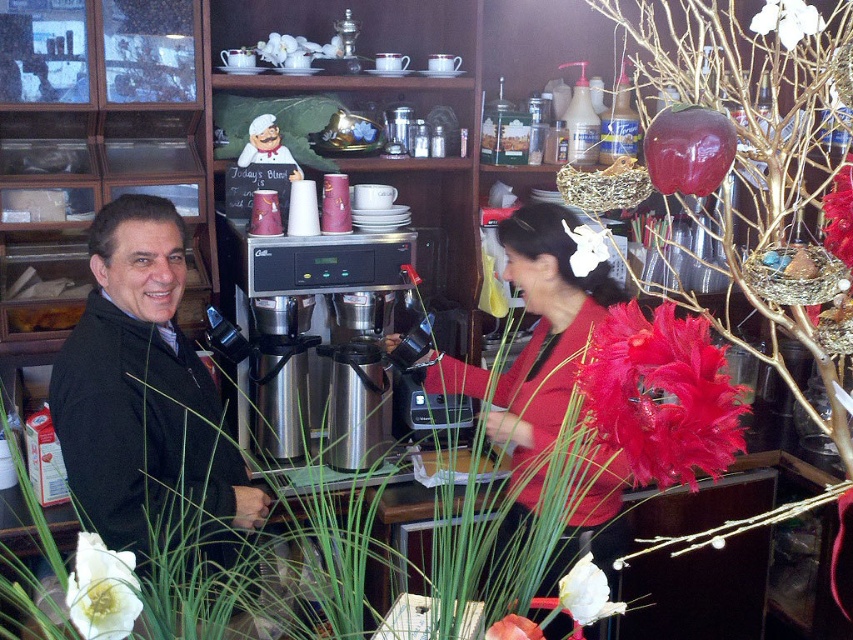
Question: From the image, what is the correct spatial relationship of stainless steel coffee machine at center in relation to white matte flower at lower center?

Choices:
 (A) above
 (B) below

Answer: (A)

Question: Does velvet red flower at center right lie behind stainless steel coffee machine at center?

Choices:
 (A) no
 (B) yes

Answer: (A)

Question: Is white matte flower at lower center smaller than white matte flower at upper right?

Choices:
 (A) yes
 (B) no

Answer: (A)

Question: Which object is farther from the camera taking this photo?

Choices:
 (A) velvet red flower at center right
 (B) white matte flower at lower center
 (C) white matte flower at upper right

Answer: (C)

Question: Among these objects, which one is farthest from the camera?

Choices:
 (A) matte black jacket at left
 (B) white matte flower at upper right
 (C) matte red sweater at center
 (D) stainless steel coffee machine at center

Answer: (D)

Question: Which is nearer to the velvet red flower at center right?

Choices:
 (A) white matte flower at lower left
 (B) matte red sweater at center
 (C) white matte flower at lower center
 (D) stainless steel coffee machine at center

Answer: (C)